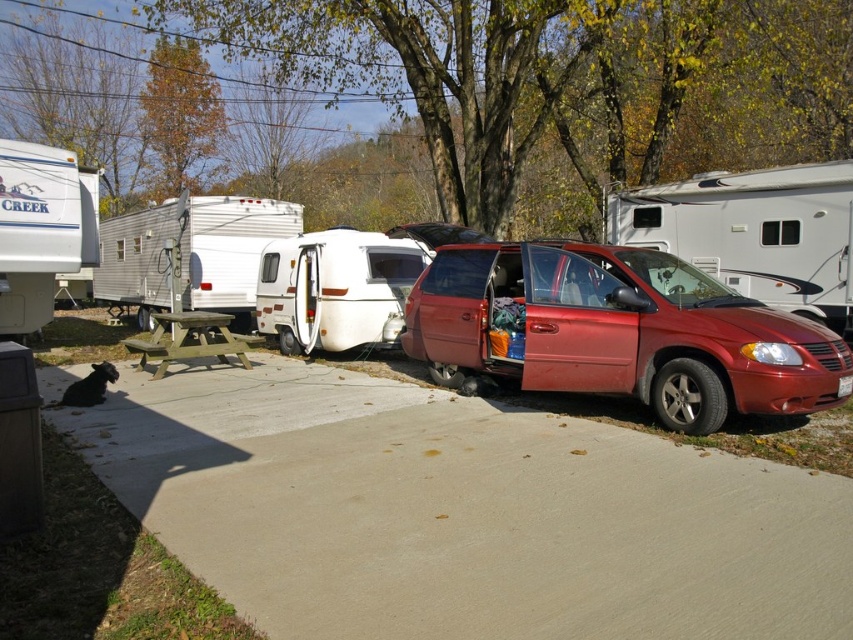
You are a photographer standing at the edge of the campground. You want to take a photo of the shiny red minivan at center and the white glossy camper at center. Which one will appear larger in your photo?

The shiny red minivan at center will appear larger in the photo because it is closer to the viewer than the white glossy camper at center.

You are planning to park your car between the matte red van at upper right and the white glossy camper at center. Given that your car is 15 feet long, will there be enough space between them to park your car?

The distance between the matte red van at upper right and the white glossy camper at center is 20.42 feet. Since your car is 15 feet long, there is sufficient space to park between them as 20.42 feet is greater than 15 feet.